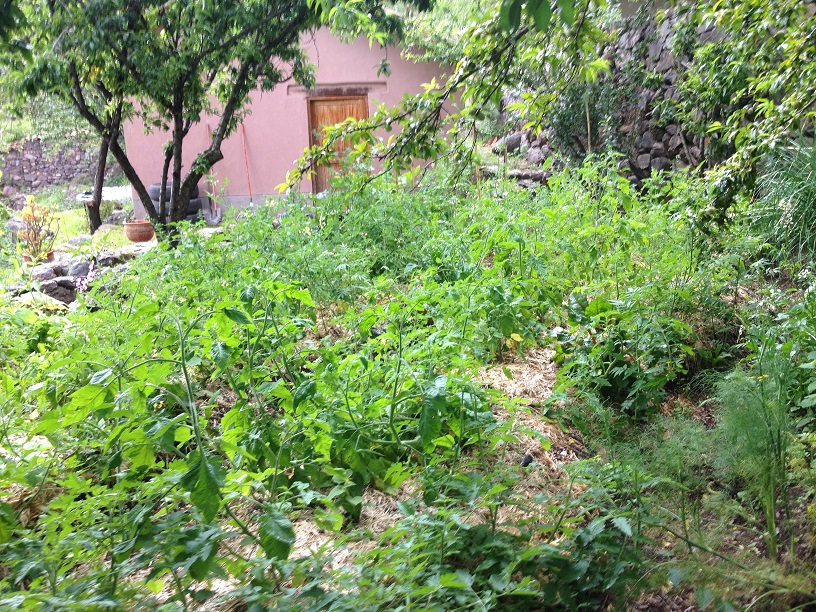
You are a GUI agent. You are given a task and a screenshot of the screen. Output one action in this format:
    pyautogui.click(x=<x>, y=<y>)
    Task: Click on the planter
    The image size is (816, 612).
    Given the screenshot: What is the action you would take?
    pyautogui.click(x=140, y=229)